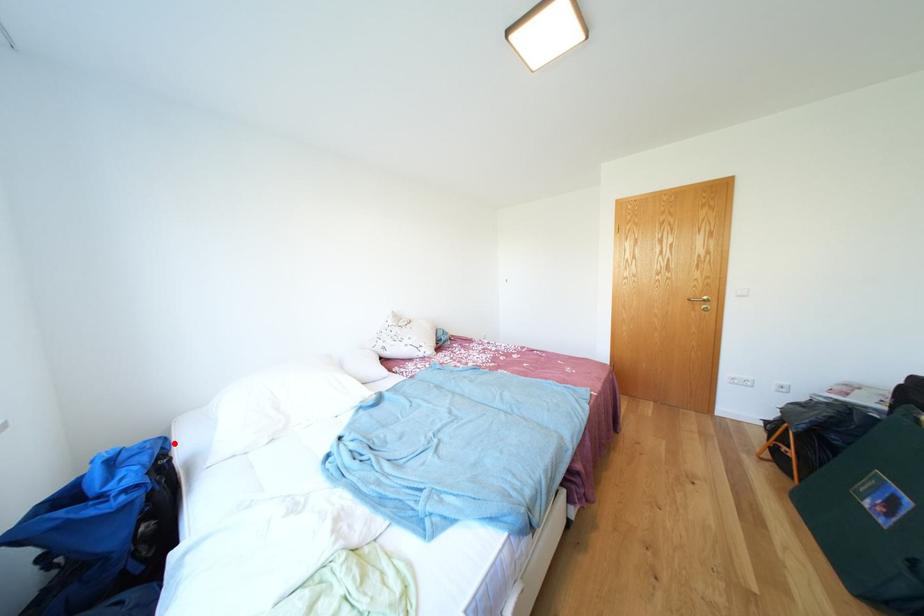
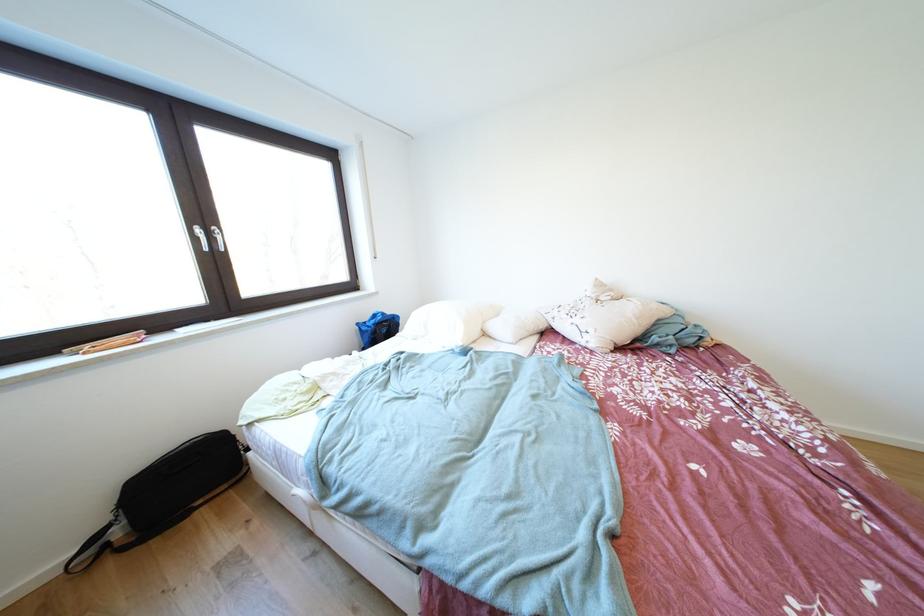
The point at the highlighted location is marked in the first image. Where is the corresponding point in the second image?

(407, 321)